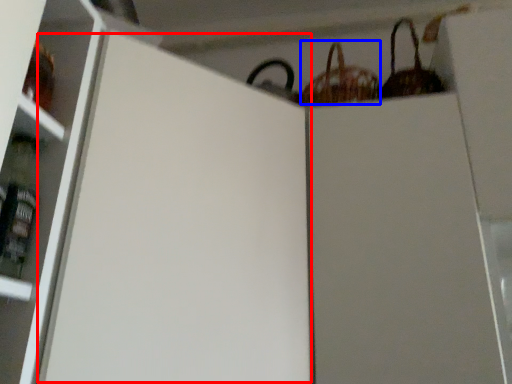
Question: Which of the following is the closest to the observer, screen door (highlighted by a red box) or basket (highlighted by a blue box)?

Choices:
 (A) screen door
 (B) basket

Answer: (A)